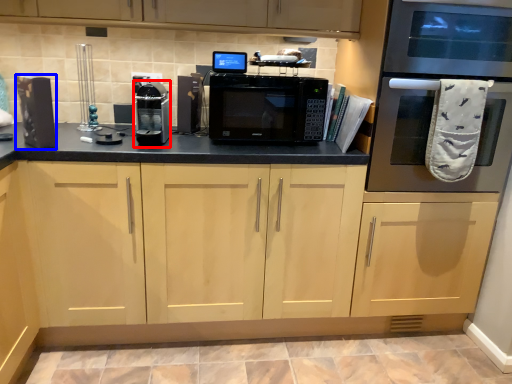
Question: Which of the following is the farthest to the observer, appliance (highlighted by a red box) or appliance (highlighted by a blue box)?

Choices:
 (A) appliance
 (B) appliance

Answer: (A)